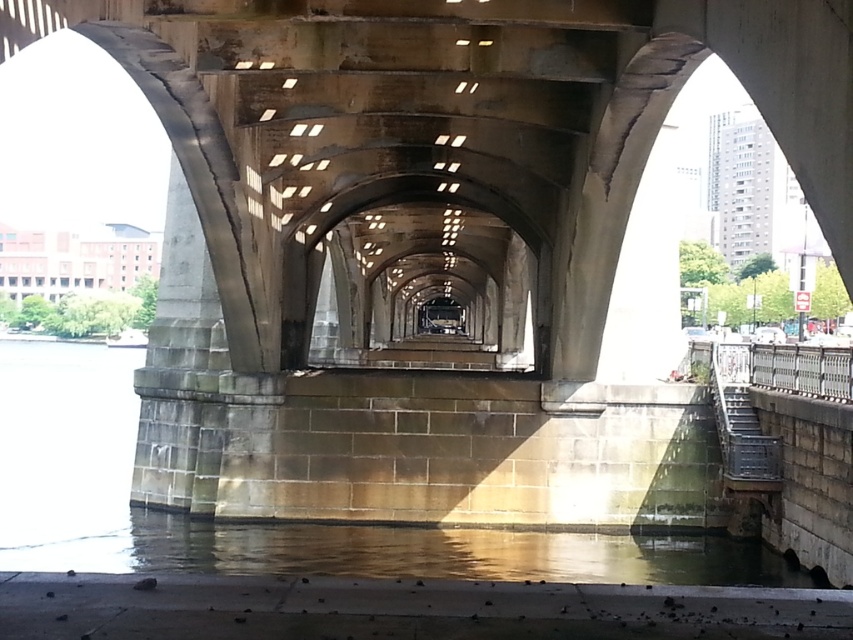
You are standing at the water edge and see the clear water at lower center and the gray stone pillar at center. Which object appears smaller in the image?

The clear water at lower center appears smaller than the gray stone pillar at center in the image.

You are standing near the water under the bridge and want to cross from the clear water at lower center to the gray stone pillar at center. Which path is wider between the two?

The clear water at lower center is wider than the gray stone pillar at center, so the path over the clear water at lower center is wider.